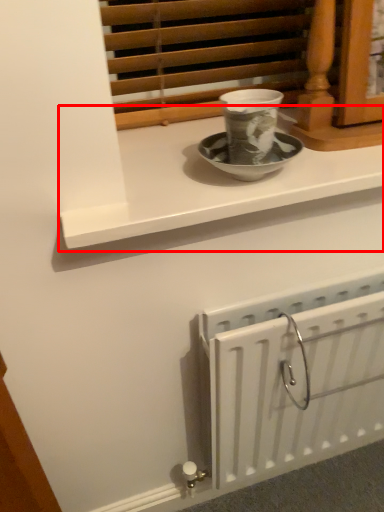
Question: Considering the relative positions of window sill (annotated by the red box) and radiator in the image provided, where is window sill (annotated by the red box) located with respect to the staircase?

Choices:
 (A) left
 (B) right

Answer: (A)